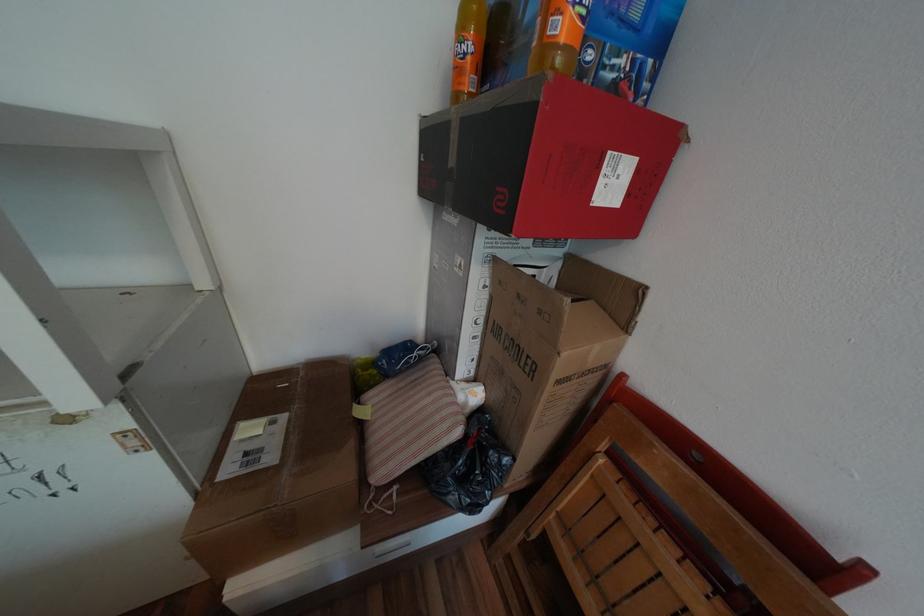
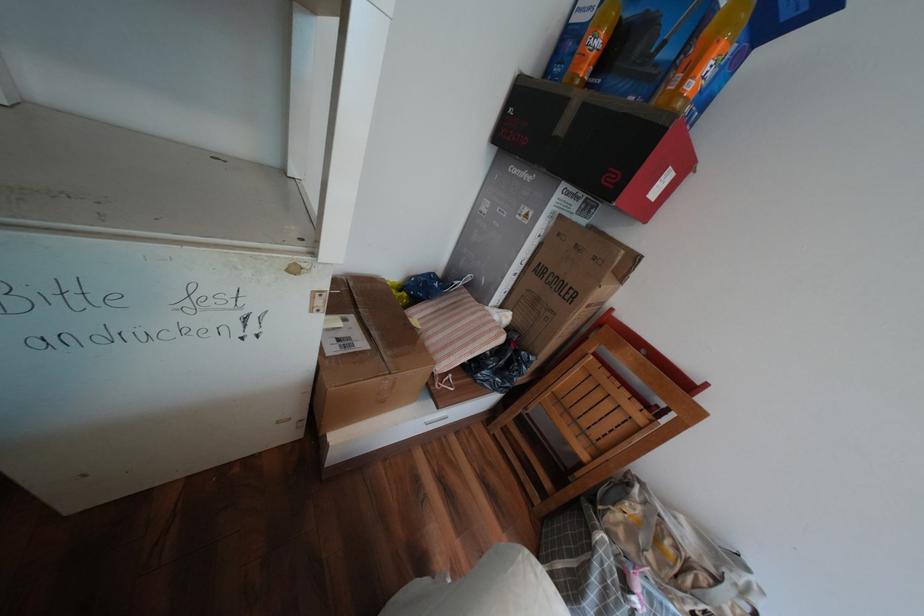
Question: The first image is from the beginning of the video and the second image is from the end. How did the camera likely rotate when shooting the video?

Choices:
 (A) Left
 (B) Right
 (C) Up
 (D) Down

Answer: (B)